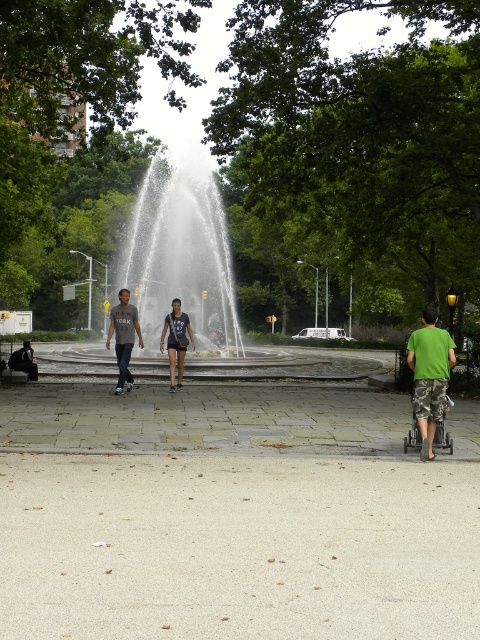
You are standing at the point marked as point (141, 340) in the park scene. The park has a fountain in the center and a paved area with debris. If you want to walk towards the fountain, which direction should you move relative to your current position?

Since the distance of point (141, 340) from the viewer is 49.96 feet, you are currently 49.96 feet away from the fountain. To walk towards the fountain, you should move forward from your current position at point (141, 340).